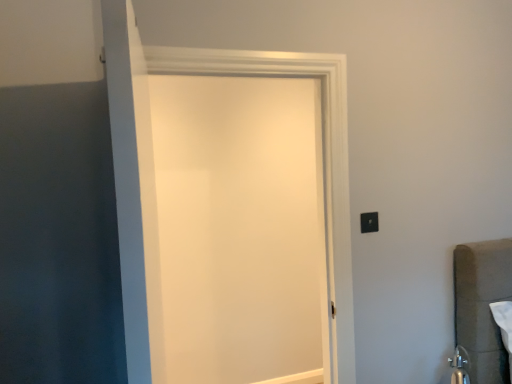
This screenshot has height=384, width=512. What are the coordinates of `white matte door at center` in the screenshot? It's located at (324, 160).

The width and height of the screenshot is (512, 384). Describe the element at coordinates (324, 160) in the screenshot. I see `white matte door at center` at that location.

This screenshot has height=384, width=512. I want to click on white matte door at center, so click(x=324, y=160).